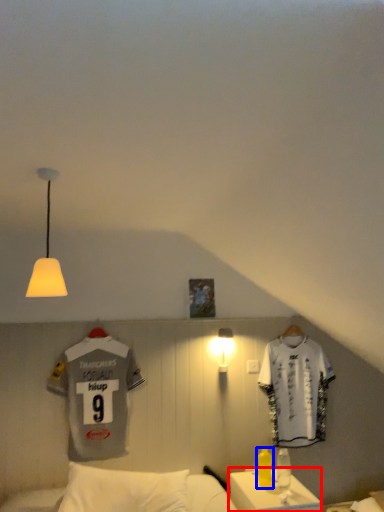
Question: Among these objects, which one is nearest to the camera, table (highlighted by a red box) or bottle (highlighted by a blue box)?

Choices:
 (A) table
 (B) bottle

Answer: (A)